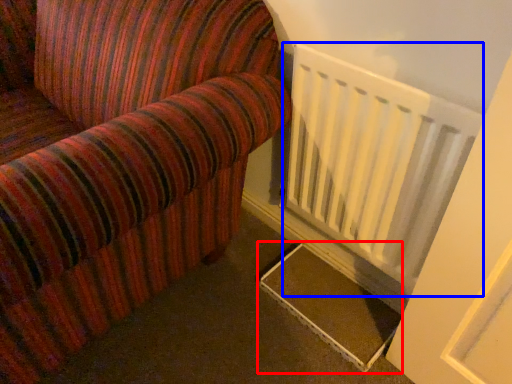
Question: Which of the following is the closest to the observer, stairs (highlighted by a red box) or radiator (highlighted by a blue box)?

Choices:
 (A) stairs
 (B) radiator

Answer: (B)